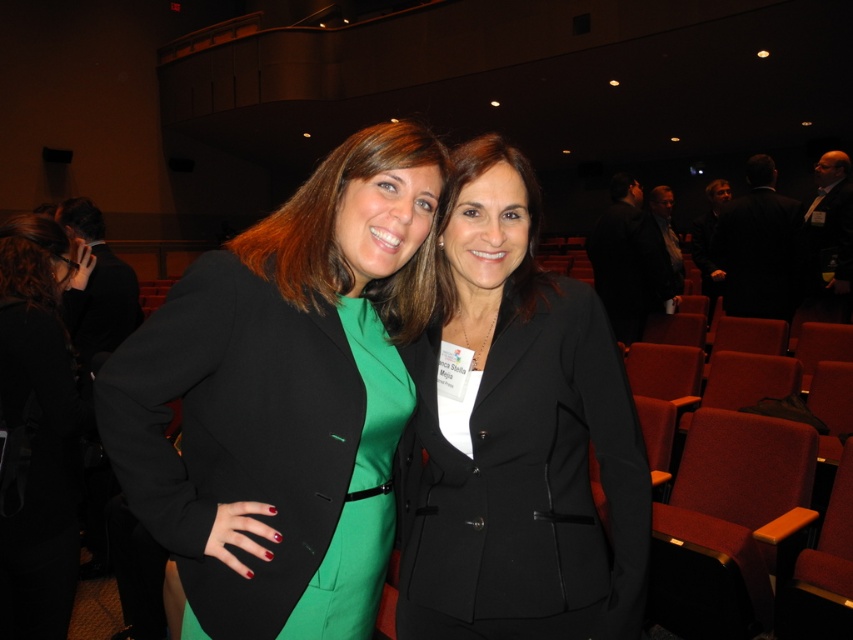
You are standing in the auditorium and want to locate the matte black blazer at center. According to the coordinates provided, where should you look?

The matte black blazer at center is located at coordinates point (285,396).

You are standing in the auditorium and want to point to the exact location of the point labeled as point [285,396]. According to the scene, where exactly is this point located?

The point labeled [285,396] is located on the matte black blazer at center.